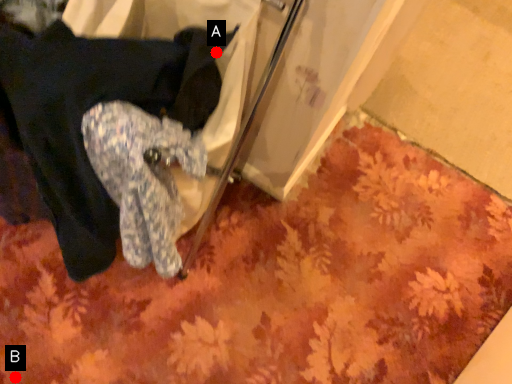
Question: Two points are circled on the image, labeled by A and B beside each circle. Which of the following is the farthest from the observer?

Choices:
 (A) A is further
 (B) B is further

Answer: (B)